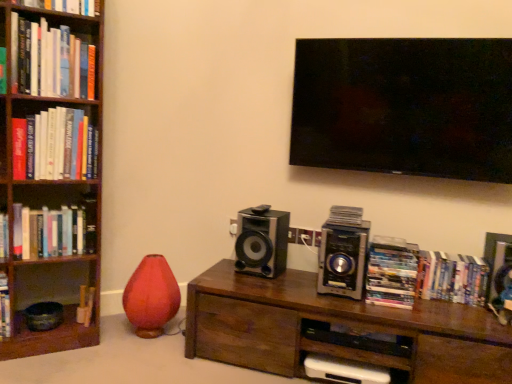
Question: Considering the positions of wooden bookshelf at left and hardcover books at center right, which appears as the 7th book when viewed from the left, in the image, is wooden bookshelf at left taller or shorter than hardcover books at center right, which appears as the 7th book when viewed from the left,?

Choices:
 (A) tall
 (B) short

Answer: (A)

Question: Is wooden bookshelf at left in front of or behind hardcover books at center right, the 2th book when ordered from bottom to top, in the image?

Choices:
 (A) behind
 (B) front

Answer: (B)

Question: Based on their relative distances, which object is farther from the hardcover book at upper left, the fourth book positioned from the left?

Choices:
 (A) hardcover books at center right, the 6th book in the left-to-right sequence
 (B) brown wood table at center
 (C) hardcover books at left, the sixth book in the bottom-to-top sequence
 (D) hardcover book at left, which is the first book from left to right
 (E) matte red vase at lower left

Answer: (A)

Question: Estimate the real-world distances between objects in this image. Which object is farther from the metallic silver speaker at center-right, the 1th speaker viewed from the right?

Choices:
 (A) hardcover books at center right, the 2th book when ordered from bottom to top
 (B) hardcover books at left, which ranks as the third book in left-to-right order
 (C) hardcover book at left, marked as the seventh book in a right-to-left arrangement
 (D) hardcover book at left, which ranks as the 1th book in bottom-to-top order
 (E) brown wood table at center

Answer: (B)